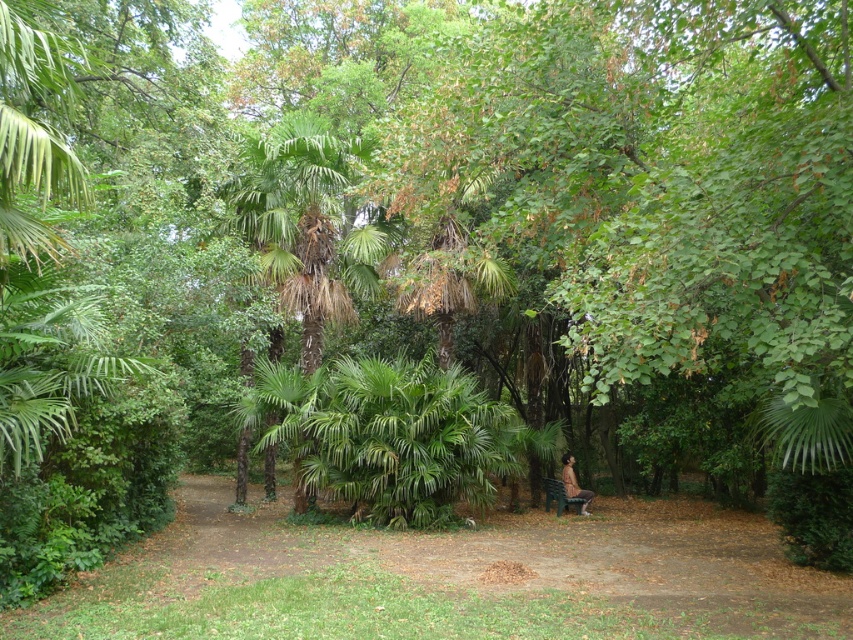
Who is positioned more to the left, green leafy palm tree at center or brown textured jacket at center?

green leafy palm tree at center

Can you confirm if green leafy palm tree at center is wider than brown textured jacket at center?

Yes, green leafy palm tree at center is wider than brown textured jacket at center.

Is point (270, 193) positioned in front of point (564, 477)?

Yes, it is in front of point (564, 477).

The width and height of the screenshot is (853, 640). I want to click on green leafy palm tree at center, so click(306, 225).

Does green leafy palm tree at center have a lesser height compared to green plastic bench at center?

No.

Is green leafy palm tree at center thinner than green plastic bench at center?

In fact, green leafy palm tree at center might be wider than green plastic bench at center.

Image resolution: width=853 pixels, height=640 pixels. Identify the location of green leafy palm tree at center. (306, 225).

Describe the element at coordinates (573, 483) in the screenshot. Image resolution: width=853 pixels, height=640 pixels. I see `brown textured jacket at center` at that location.

Which is above, brown textured jacket at center or green plastic bench at center?

brown textured jacket at center is above.

The image size is (853, 640). Find the location of `brown textured jacket at center`. brown textured jacket at center is located at coordinates (573, 483).

Identify the location of brown textured jacket at center. (573, 483).